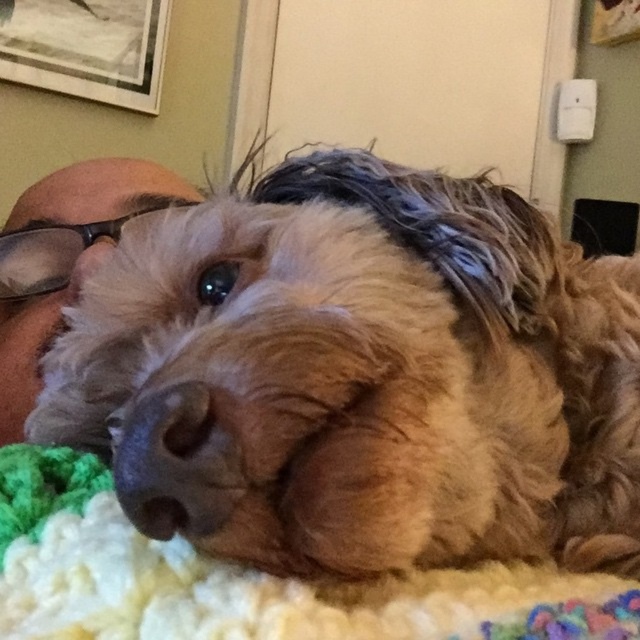
In the scene shown: You are a delivery person who needs to place a small package between the brown fluffy dog at center and the knitted wool blanket at lower center. Can you fit the package there?

The distance between the brown fluffy dog at center and the knitted wool blanket at lower center is 3.24 inches. If the package is smaller than this distance, it can fit between them.

You are holding a remote control that is 6 inches long. You want to place it on the spot marked by point (563, 486). Can the remote control fit on that spot without overlapping?

The point (563, 486) is a single point, so the remote control cannot fit there as it requires a surface area. Please place it on a larger surface nearby.

You are holding a small stuffed animal that is 10 inches long. You want to place it on the floor next to the brown fluffy dog at center. Can you estimate whether the stuffed animal will fit next to the dog without overlapping?

The brown fluffy dog at center is 9.87 inches away from the viewer. Since the stuffed animal is 10 inches long, it might not fit next to the dog without overlapping because the distance is slightly less than the stuffed animal length.